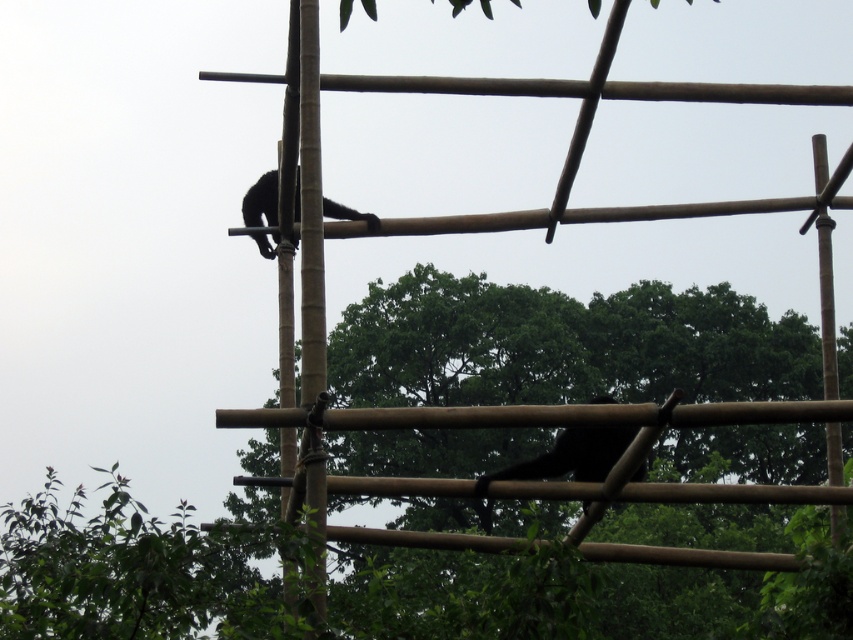
Question: Which of these objects is positioned closest to the brown bamboo pole at upper left?

Choices:
 (A) black matte monkey at lower right
 (B) green leafy tree at center

Answer: (A)

Question: In this image, where is green leafy tree at center located relative to brown bamboo pole at upper left?

Choices:
 (A) above
 (B) below

Answer: (B)

Question: Can you confirm if green leafy tree at center is thinner than black fur monkey at upper center?

Choices:
 (A) yes
 (B) no

Answer: (B)

Question: Which object is closer to the camera taking this photo?

Choices:
 (A) black fur monkey at upper center
 (B) black matte monkey at lower right

Answer: (B)

Question: Does green leafy tree at center appear on the right side of brown bamboo pole at upper left?

Choices:
 (A) no
 (B) yes

Answer: (B)

Question: Which point is farther from the camera taking this photo?

Choices:
 (A) coord(500,468)
 (B) coord(376,296)

Answer: (A)